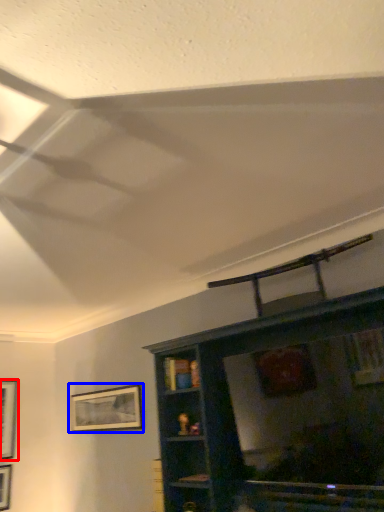
Question: Which object appears farthest to the camera in this image, picture frame (highlighted by a red box) or picture frame (highlighted by a blue box)?

Choices:
 (A) picture frame
 (B) picture frame

Answer: (A)